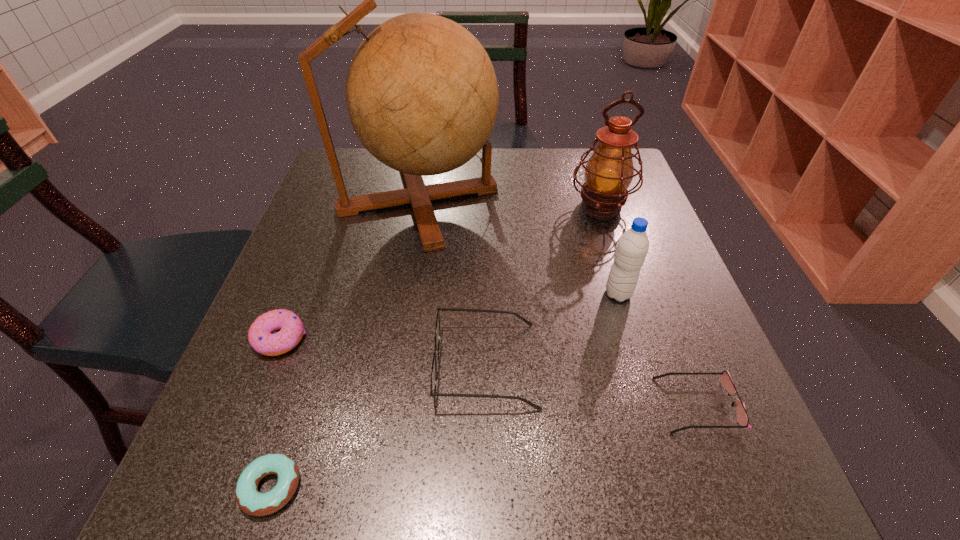
This screenshot has width=960, height=540. Identify the location of globe that is positioned at the far edge. (422, 96).

Find the location of a particular element. Image resolution: width=960 pixels, height=540 pixels. oil lamp that is at the far edge is located at coordinates (609, 172).

Where is `object that is at the near edge`? This screenshot has height=540, width=960. object that is at the near edge is located at coordinates (251, 501).

Identify the location of globe that is at the left edge. This screenshot has width=960, height=540. click(x=422, y=96).

Find the location of a particular element. oil lamp that is at the right edge is located at coordinates (609, 172).

This screenshot has width=960, height=540. I want to click on water bottle located at the right edge, so click(632, 248).

Locate an element on the screen. The width and height of the screenshot is (960, 540). sunglasses that is positioned at the right edge is located at coordinates (742, 417).

Locate an element on the screen. The height and width of the screenshot is (540, 960). object that is positioned at the far left corner is located at coordinates (422, 96).

Identify the location of object positioned at the near left corner. This screenshot has height=540, width=960. (251, 501).

Locate an element on the screen. object at the far right corner is located at coordinates (609, 172).